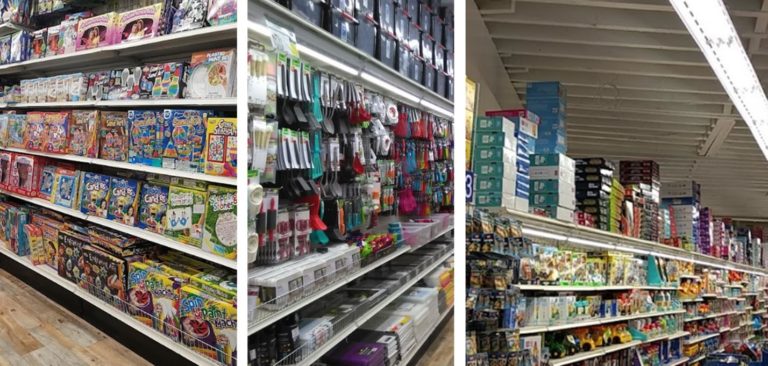
What are the coordinates of `floor` in the screenshot? It's located at (61, 336), (445, 351).